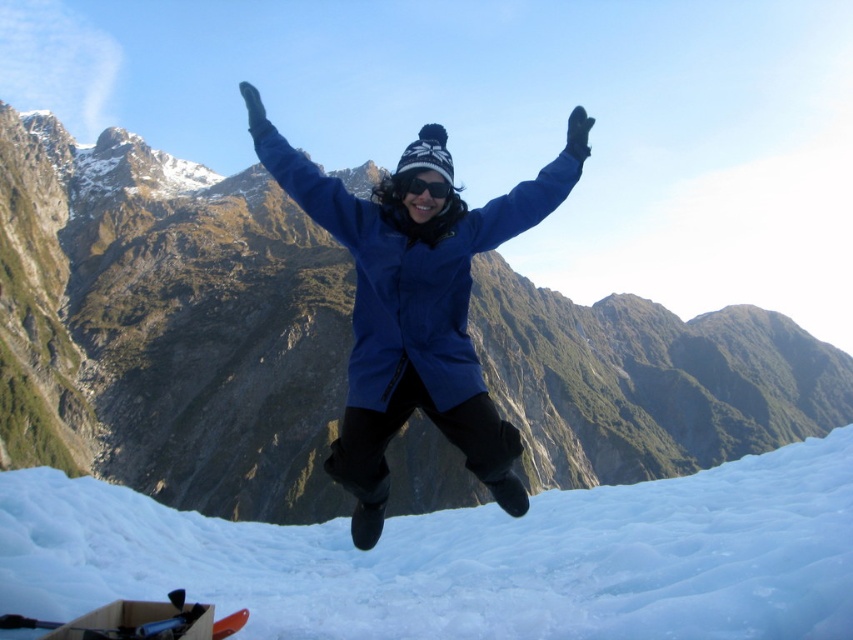
Can you confirm if blue matte jacket at center is shorter than black matte goggles at center?

In fact, blue matte jacket at center may be taller than black matte goggles at center.

Which of these two, blue matte jacket at center or black matte goggles at center, stands shorter?

black matte goggles at center

Where is `blue matte jacket at center`? blue matte jacket at center is located at coordinates (416, 305).

Can you confirm if matte blue jacket at center is shorter than blue matte jacket at center?

No.

Where is `matte blue jacket at center`? The width and height of the screenshot is (853, 640). matte blue jacket at center is located at coordinates (167, 324).

Does point (761, 339) come behind point (500, 442)?

Yes, point (761, 339) is behind point (500, 442).

This screenshot has height=640, width=853. I want to click on matte blue jacket at center, so click(167, 324).

Is white frosty snow at lower center bigger than blue matte jacket at center?

No, white frosty snow at lower center is not bigger than blue matte jacket at center.

Is white frosty snow at lower center above blue matte jacket at center?

Actually, white frosty snow at lower center is below blue matte jacket at center.

I want to click on white frosty snow at lower center, so click(469, 557).

At what (x,y) coordinates should I click in order to perform the action: click on white frosty snow at lower center. Please return your answer as a coordinate pair (x, y). This screenshot has height=640, width=853. Looking at the image, I should click on (469, 557).